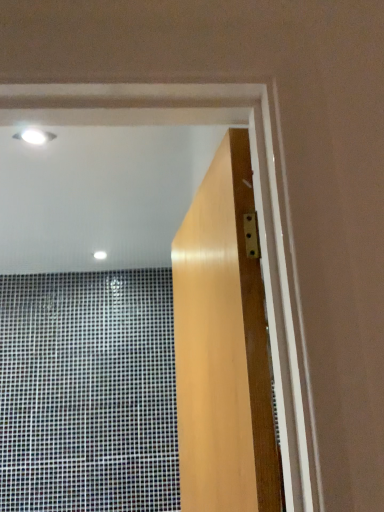
Identify the location of light brown wood door at center. (223, 347).

What is the approximate width of light brown wood door at center?

The width of light brown wood door at center is 4.73 inches.

Describe the element at coordinates (223, 347) in the screenshot. I see `light brown wood door at center` at that location.

You are a GUI agent. You are given a task and a screenshot of the screen. Output one action in this format:
    pyautogui.click(x=<x>, y=<y>)
    Task: Click on the light brown wood door at center
    The image size is (384, 512).
    Given the screenshot: What is the action you would take?
    pyautogui.click(x=223, y=347)